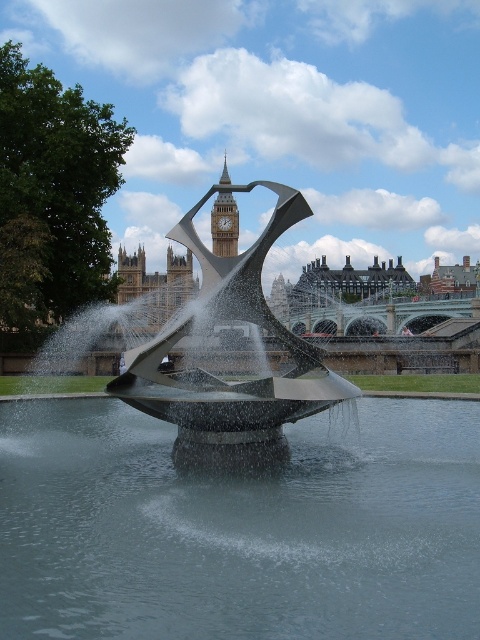
Consider the image. You are a photographer planning to take a wide shot of the sculpture and the clock tower. Given the clear water at center and the polished stone clock tower at upper center, which object will occupy more space in your photo?

The clear water at center will occupy more space in the photo because it is larger in size than the polished stone clock tower at upper center according to the description.

You are an architect evaluating the spatial relationship between the two landmarks. Given the polished stainless steel sculpture at center and the polished stone clock tower at upper center, which one is wider in the image?

The polished stainless steel sculpture at center is wider than the polished stone clock tower at upper center according to the description.